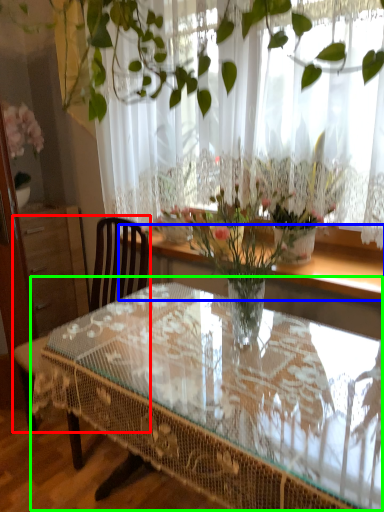
Question: Which is nearer to the chair (highlighted by a red box)? window sill (highlighted by a blue box) or coffee table (highlighted by a green box).

Choices:
 (A) window sill
 (B) coffee table

Answer: (B)